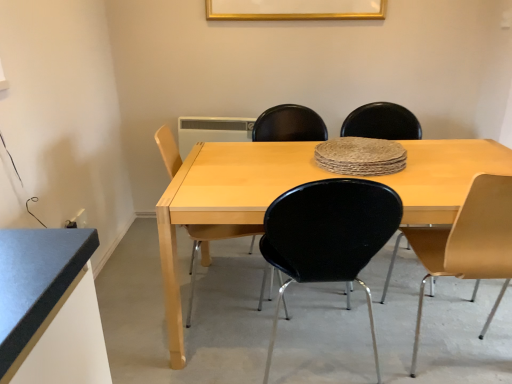
This screenshot has height=384, width=512. I want to click on empty space that is in between glossy black chair at center, placed as the third chair when sorted from right to left, and light wood/black plastic chair at center, the 1th chair when ordered from left to right, so click(x=255, y=329).